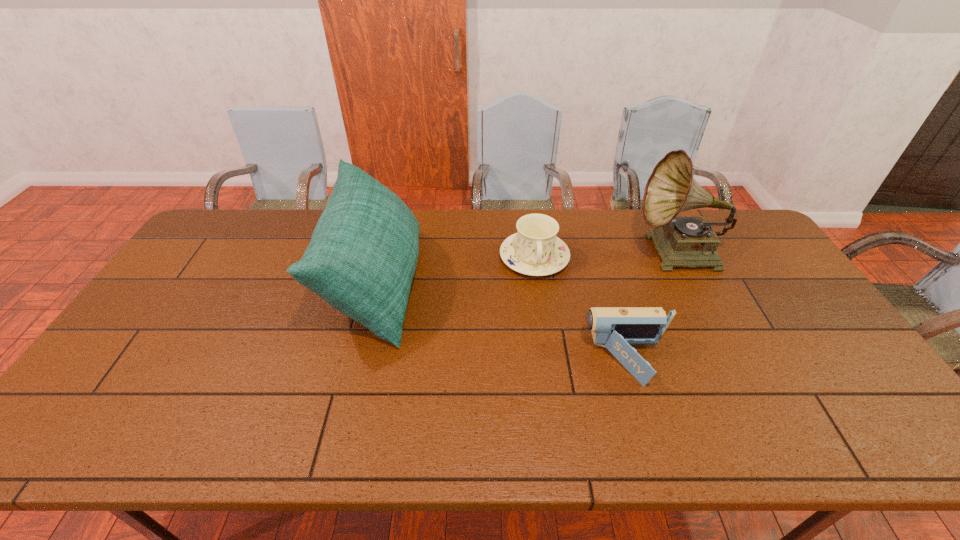
At what (x,y) coordinates should I click in order to perform the action: click on vacant position located 0.250m on the handle side of the chinaware. Please return your answer as a coordinate pair (x, y). The width and height of the screenshot is (960, 540). Looking at the image, I should click on (546, 346).

Identify the location of vacant space located on the side of the camcorder with the flip-out screen. This screenshot has height=540, width=960. (481, 360).

This screenshot has width=960, height=540. I want to click on free spot located on the side of the camcorder with the flip-out screen, so click(x=477, y=360).

Where is `vacant space located on the side of the camcorder with the flip-out screen`? vacant space located on the side of the camcorder with the flip-out screen is located at coordinates (558, 360).

Find the location of a particular element. record player that is at the far edge is located at coordinates (680, 241).

What are the coordinates of `cushion located at the far edge` in the screenshot? It's located at (363, 253).

At what (x,y) coordinates should I click in order to perform the action: click on chinaware that is at the far edge. Please return your answer as a coordinate pair (x, y). Looking at the image, I should click on (534, 250).

You are a GUI agent. You are given a task and a screenshot of the screen. Output one action in this format:
    pyautogui.click(x=<x>, y=<y>)
    Task: Click on the vacant region at the far edge
    The height and width of the screenshot is (540, 960).
    Given the screenshot: What is the action you would take?
    pyautogui.click(x=433, y=233)

In the image, there is a desktop. Where is `vacant space at the near edge`? The width and height of the screenshot is (960, 540). vacant space at the near edge is located at coordinates (540, 437).

This screenshot has width=960, height=540. In the image, there is a desktop. In order to click on vacant space at the left edge in this screenshot , I will do `click(216, 254)`.